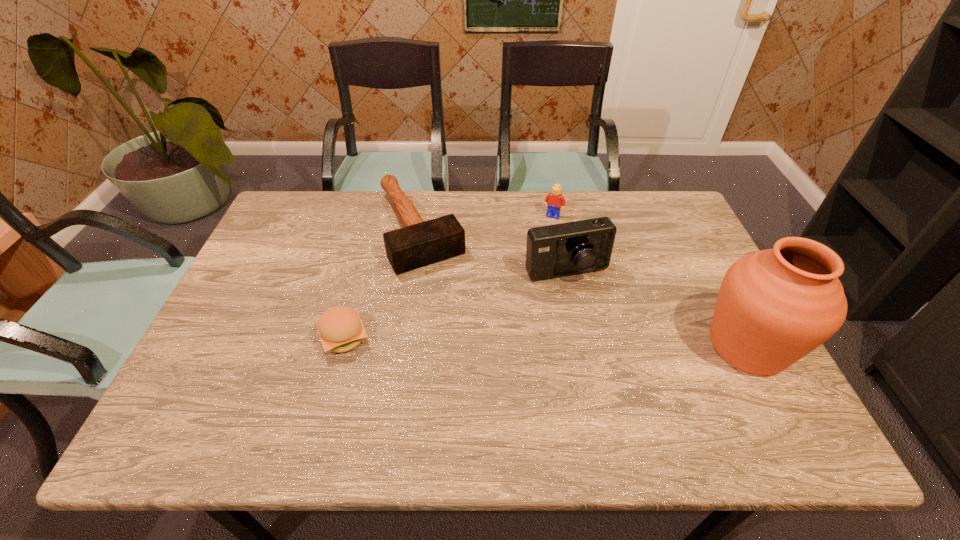
Where is `hamburger`? The image size is (960, 540). hamburger is located at coordinates (340, 328).

You are a GUI agent. You are given a task and a screenshot of the screen. Output one action in this format:
    pyautogui.click(x=<x>, y=<y>)
    Task: Click on the tallest object
    This screenshot has height=540, width=960.
    Given the screenshot: What is the action you would take?
    pyautogui.click(x=775, y=306)

This screenshot has width=960, height=540. Find the location of `urn`. urn is located at coordinates (775, 306).

Image resolution: width=960 pixels, height=540 pixels. Find the location of `mallet`. mallet is located at coordinates (419, 243).

You are a GUI agent. You are given a task and a screenshot of the screen. Output one action in this format:
    pyautogui.click(x=<x>, y=<y>)
    Task: Click on the camera
    Image resolution: width=960 pixels, height=540 pixels.
    Given the screenshot: What is the action you would take?
    pyautogui.click(x=583, y=246)

Identify the location of the third tallest object. click(554, 201).

You are a GUI agent. You are given a task and a screenshot of the screen. Output one action in this format:
    pyautogui.click(x=<x>, y=<y>)
    Task: Click on the free space located 0.370m on the back of the hamburger
    This screenshot has width=960, height=540.
    Given the screenshot: What is the action you would take?
    pyautogui.click(x=374, y=227)

Identify the location of free space located 0.200m on the left of the urn. (616, 346).

This screenshot has width=960, height=540. Find the location of `free space located on the striking face of the mallet`. free space located on the striking face of the mallet is located at coordinates (494, 372).

This screenshot has height=540, width=960. I want to click on free point located on the striking face of the mallet, so click(458, 309).